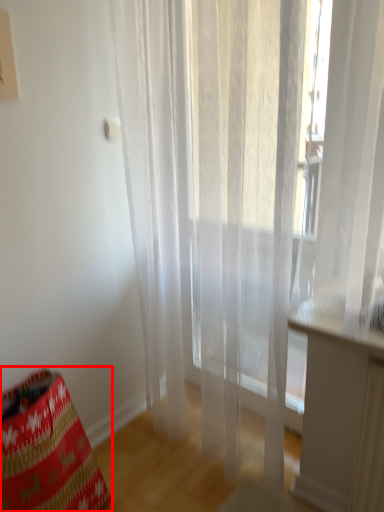
Question: From the image's perspective, where is bean bag chair (annotated by the red box) located relative to curtain?

Choices:
 (A) below
 (B) above

Answer: (A)